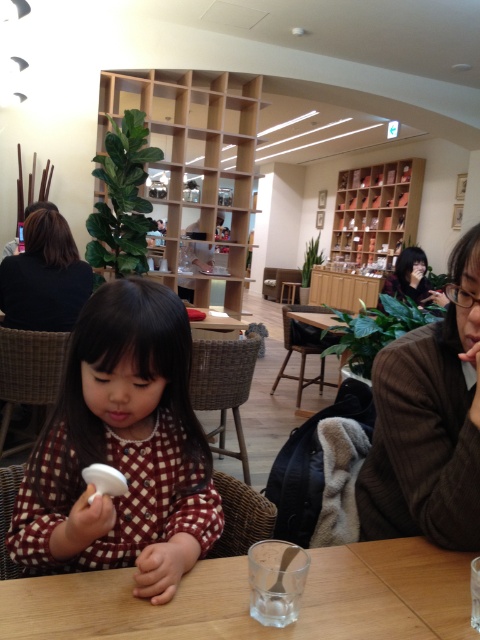
Looking at this image, which is below, white matte spoon at center or matte black hair at upper right?

white matte spoon at center is below.

Where is `white matte spoon at center`? This screenshot has height=640, width=480. white matte spoon at center is located at coordinates (121, 449).

Is dark brown hair at upper left taller than matte black hair at upper right?

Yes.

Between dark brown hair at upper left and matte black hair at upper right, which one has more height?

dark brown hair at upper left

Describe the element at coordinates (45, 276) in the screenshot. I see `dark brown hair at upper left` at that location.

Identify the location of dark brown hair at upper left. click(45, 276).

Does point (159, 486) come closer to viewer compared to point (37, 240)?

Yes, it is in front of point (37, 240).

Between point (132, 538) and point (75, 292), which one is positioned behind?

Positioned behind is point (75, 292).

Who is more distant from viewer, [142,556] or [33,304]?

The point [33,304] is more distant.

Identify the location of white matte spoon at center. (121, 449).